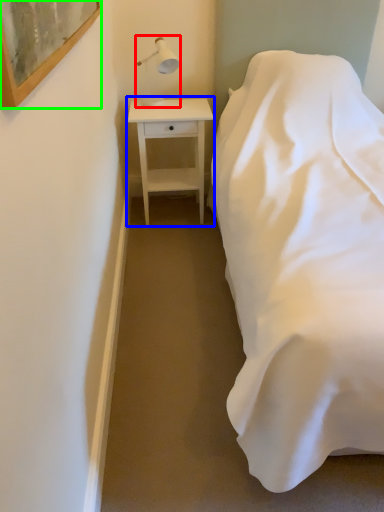
Question: Which object is positioned farthest from table lamp (highlighted by a red box)? Select from nightstand (highlighted by a blue box) and picture frame (highlighted by a green box).

Choices:
 (A) nightstand
 (B) picture frame

Answer: (B)